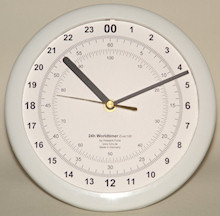
You are a GUI agent. You are given a task and a screenshot of the screen. Output one action in this format:
    pyautogui.click(x=<x>, y=<y>)
    Task: Click on the clock
    The height and width of the screenshot is (216, 220).
    Given the screenshot: What is the action you would take?
    pyautogui.click(x=101, y=26)